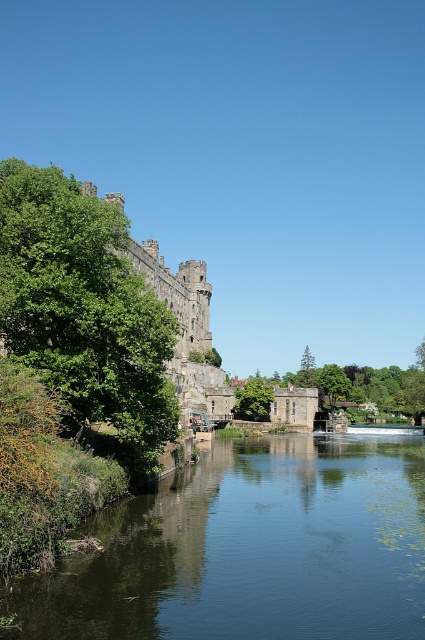
Question: Based on their relative distances, which object is nearer to the green leafy tree at left?

Choices:
 (A) dark blue water at center
 (B) green leafy tree at center

Answer: (A)

Question: Is dark blue water at center thinner than green leafy tree at center?

Choices:
 (A) yes
 (B) no

Answer: (B)

Question: Among these points, which one is nearest to the camera?

Choices:
 (A) (354, 531)
 (B) (23, 317)

Answer: (A)

Question: Does green leafy tree at left appear on the left side of green leafy tree at center?

Choices:
 (A) yes
 (B) no

Answer: (A)

Question: Which point appears closest to the camera in this image?

Choices:
 (A) (187, 554)
 (B) (243, 403)
 (C) (127, 342)

Answer: (A)

Question: Is dark blue water at center closer to the viewer compared to green leafy tree at left?

Choices:
 (A) yes
 (B) no

Answer: (A)